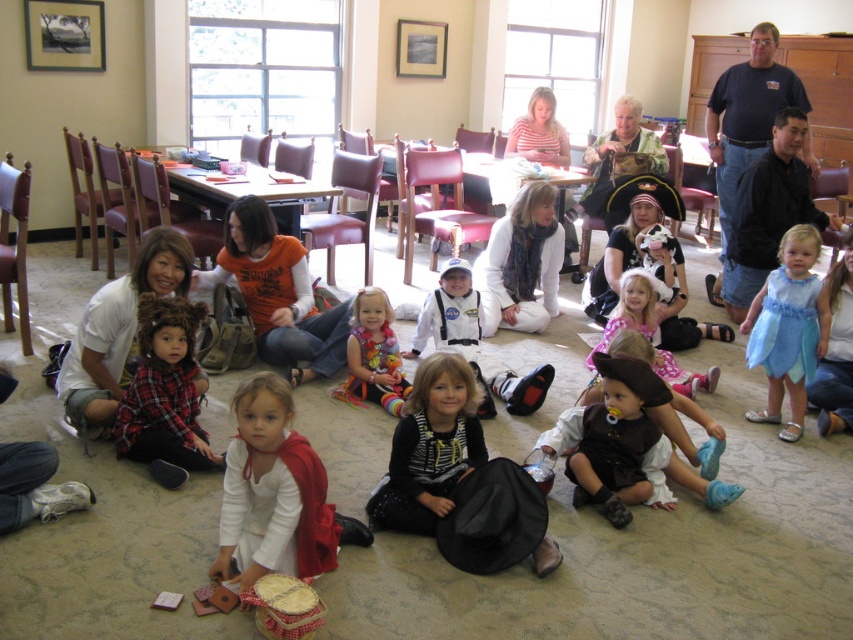
Question: Is orange cotton shirt at center below matte pink dress at center?

Choices:
 (A) no
 (B) yes

Answer: (A)

Question: Among these objects, which one is farthest from the camera?

Choices:
 (A) space suit at center
 (B) orange cotton shirt at center
 (C) fluffy multicolored sweater at center

Answer: (B)

Question: Which object is positioned farthest from the dark blue t-shirt at upper right?

Choices:
 (A) matte pink dress at center
 (B) fluffy multicolored sweater at center
 (C) light blue satin dress at lower right
 (D) plaid fabric shirt at lower left

Answer: (D)

Question: Among these objects, which one is farthest from the camera?

Choices:
 (A) dark blue t-shirt at upper right
 (B) space suit at center
 (C) fluffy multicolored sweater at center
 (D) plaid fabric shirt at lower left

Answer: (A)

Question: Can you confirm if white matte cape at center is bigger than light blue satin dress at lower right?

Choices:
 (A) yes
 (B) no

Answer: (A)

Question: Is space suit at center positioned at the back of matte pink dress at center?

Choices:
 (A) no
 (B) yes

Answer: (A)